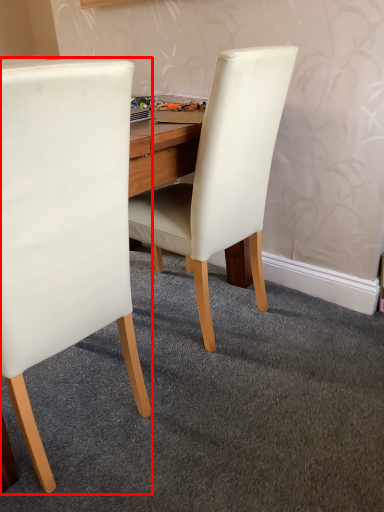
Question: From the image's perspective, where is chair (annotated by the red box) located relative to chair?

Choices:
 (A) above
 (B) below

Answer: (B)